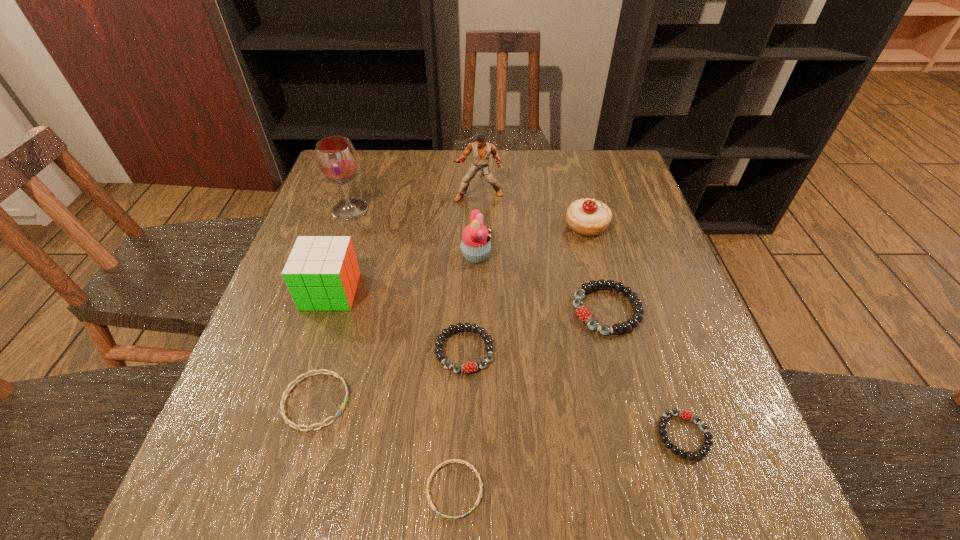
Locate an element on the screen. Image resolution: width=960 pixels, height=540 pixels. red wineglass is located at coordinates (336, 158).

At what (x,y) coordinates should I click in order to perform the action: click on puncher. Please return your answer as a coordinate pair (x, y). Looking at the image, I should click on (481, 150).

At what (x,y) coordinates should I click in order to perform the action: click on the seventh nearest object. Please return your answer as a coordinate pair (x, y). This screenshot has width=960, height=540. Looking at the image, I should click on (475, 245).

Locate an element on the screen. The image size is (960, 540). cube is located at coordinates (322, 273).

At what (x,y) coordinates should I click in order to perform the action: click on pastry. Please return your answer as a coordinate pair (x, y). The image size is (960, 540). Looking at the image, I should click on (588, 217).

In order to click on beige pastry in this screenshot , I will do `click(588, 217)`.

The height and width of the screenshot is (540, 960). What are the coordinates of `the biggest black bracelet` in the screenshot? It's located at (583, 313).

Find the location of a particular element. Image resolution: width=960 pixels, height=540 pixels. the tallest bracelet is located at coordinates (583, 313).

Image resolution: width=960 pixels, height=540 pixels. In order to click on the second tallest bracelet in this screenshot , I will do `click(468, 367)`.

I want to click on the leftmost black bracelet, so click(468, 367).